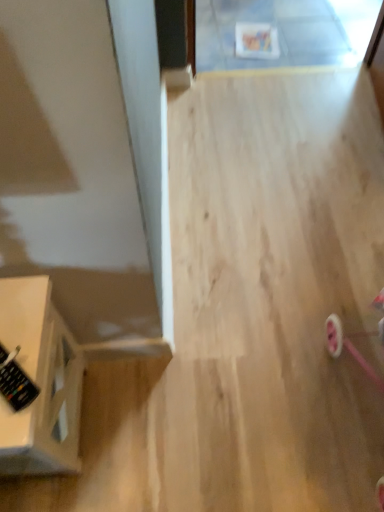
Image resolution: width=384 pixels, height=512 pixels. Find the location of `free space behind black plastic remote at lower left`. free space behind black plastic remote at lower left is located at coordinates (23, 308).